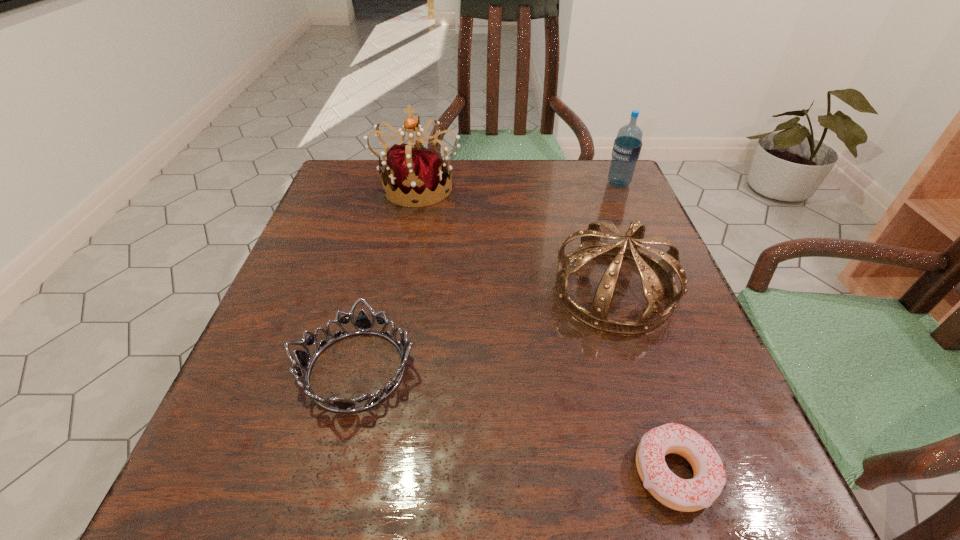
Where is `tiara that is the closest to the shortest object`? The height and width of the screenshot is (540, 960). tiara that is the closest to the shortest object is located at coordinates (651, 270).

Where is `vacant space that satisfies the following two spatial constraints: 1. on the front-facing side of the nearest object; 2. on the right side of the farthest tiara`? The width and height of the screenshot is (960, 540). vacant space that satisfies the following two spatial constraints: 1. on the front-facing side of the nearest object; 2. on the right side of the farthest tiara is located at coordinates (362, 472).

What are the coordinates of `free space that satisfies the following two spatial constraints: 1. on the front-facing side of the fourth tallest object; 2. on the right side of the nearest object` in the screenshot? It's located at (x=331, y=472).

Find the location of `free space that satisfies the following two spatial constraints: 1. on the front side of the rightmost tiara; 2. on the left side of the shortest object`. free space that satisfies the following two spatial constraints: 1. on the front side of the rightmost tiara; 2. on the left side of the shortest object is located at coordinates (671, 472).

I want to click on free space that satisfies the following two spatial constraints: 1. on the front-facing side of the shortest tiara; 2. on the left side of the shortest object, so click(331, 472).

Find the location of a particular element. free space that satisfies the following two spatial constraints: 1. on the front-facing side of the third shortest object; 2. on the right side of the farthest tiara is located at coordinates (397, 290).

Identify the location of blank area in the image that satisfies the following two spatial constraints: 1. on the front-facing side of the nearest object; 2. on the left side of the second shortest object. The height and width of the screenshot is (540, 960). tap(331, 472).

Where is `vacant space that satisfies the following two spatial constraints: 1. on the front-facing side of the nearest object; 2. on the left side of the tallest tiara`? vacant space that satisfies the following two spatial constraints: 1. on the front-facing side of the nearest object; 2. on the left side of the tallest tiara is located at coordinates (362, 472).